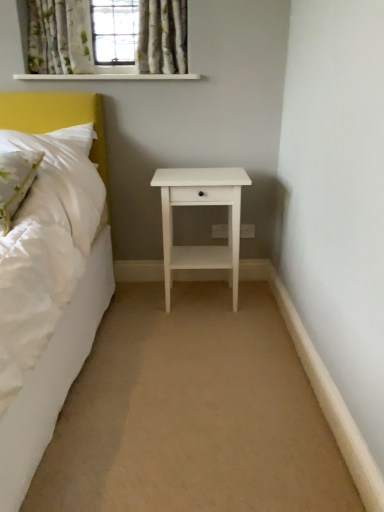
Measure the distance between floral fabric curtain at upper center, which is counted as the second curtain, starting from the left, and camera.

floral fabric curtain at upper center, which is counted as the second curtain, starting from the left, is 2.05 meters from camera.

Image resolution: width=384 pixels, height=512 pixels. What do you see at coordinates (107, 40) in the screenshot?
I see `patterned fabric curtain at upper center` at bounding box center [107, 40].

You are a GUI agent. You are given a task and a screenshot of the screen. Output one action in this format:
    pyautogui.click(x=<x>, y=<y>)
    Task: Click on the white wooden shelf at upper center
    The height and width of the screenshot is (512, 384).
    Given the screenshot: What is the action you would take?
    pyautogui.click(x=109, y=77)

How much space does green floral fabric curtain at upper left, the second curtain positioned from the right, occupy vertically?

green floral fabric curtain at upper left, the second curtain positioned from the right, is 14.99 inches tall.

Image resolution: width=384 pixels, height=512 pixels. I want to click on white matte nightstand at center, so click(201, 205).

Locate an element on the screen. floral fabric curtain at upper center, which is counted as the second curtain, starting from the left is located at coordinates (162, 37).

Does green floral fabric curtain at upper left, the second curtain positioned from the right, lie behind white matte nightstand at center?

That is True.

Is green floral fabric curtain at upper left, the second curtain positioned from the right, at the left side of white matte nightstand at center?

Indeed, green floral fabric curtain at upper left, the second curtain positioned from the right, is positioned on the left side of white matte nightstand at center.

Is point (84, 55) less distant than point (163, 193)?

That is False.

Looking at this image, from a real-world perspective, between green floral fabric curtain at upper left, which is counted as the 1th curtain, starting from the left, and white matte nightstand at center, who is vertically lower?

white matte nightstand at center.

Looking at the image, does patterned fabric curtain at upper center seem bigger or smaller compared to green floral fabric pillow at left?

Clearly, patterned fabric curtain at upper center is larger in size than green floral fabric pillow at left.

Is patterned fabric curtain at upper center looking in the opposite direction of green floral fabric pillow at left?

That's not correct — patterned fabric curtain at upper center is not looking away from green floral fabric pillow at left.

In the image, is patterned fabric curtain at upper center on the left side or the right side of green floral fabric pillow at left?

From the image, it's evident that patterned fabric curtain at upper center is to the right of green floral fabric pillow at left.

Between patterned fabric curtain at upper center and green floral fabric pillow at left, which one is positioned in front?

green floral fabric pillow at left is closer to the camera.

From the image's perspective, who appears lower, white matte nightstand at center or patterned fabric curtain at upper center?

white matte nightstand at center is shown below in the image.

Is white matte nightstand at center located outside patterned fabric curtain at upper center?

Yes, white matte nightstand at center is located beyond the bounds of patterned fabric curtain at upper center.

How many degrees apart are the facing directions of white matte nightstand at center and patterned fabric curtain at upper center?

The angle between the facing direction of white matte nightstand at center and the facing direction of patterned fabric curtain at upper center is 0.758 degrees.

From a real-world perspective, relative to green floral fabric pillow at left, is beige carpet at center vertically above or below?

beige carpet at center is below green floral fabric pillow at left.

Does point (211, 433) appear closer or farther from the camera than point (15, 193)?

Point (211, 433).

Considering the relative sizes of beige carpet at center and green floral fabric pillow at left in the image provided, is beige carpet at center taller than green floral fabric pillow at left?

Incorrect, the height of beige carpet at center is not larger of that of green floral fabric pillow at left.

Based on the photo, can we say beige carpet at center lies outside green floral fabric pillow at left?

Result: beige carpet at center is positioned outside green floral fabric pillow at left.

Which of these two, beige carpet at center or white matte nightstand at center, stands shorter?

With less height is beige carpet at center.

Is beige carpet at center facing away from white matte nightstand at center?

No.

From the image's perspective, is beige carpet at center above or below white matte nightstand at center?

Based on their image positions, beige carpet at center is located beneath white matte nightstand at center.

Which of these two, floral fabric curtain at upper center, the 1th curtain positioned from the right, or green floral fabric pillow at left, stands shorter?

green floral fabric pillow at left is shorter.

Which is further, (185, 30) or (26, 166)?

The point (185, 30) is farther from the camera.

Where is `pillow lying below the floral fabric curtain at upper center, which is counted as the second curtain, starting from the left (from the image's perspective)`? The image size is (384, 512). pillow lying below the floral fabric curtain at upper center, which is counted as the second curtain, starting from the left (from the image's perspective) is located at coordinates (15, 182).

Which of these two, floral fabric curtain at upper center, the 1th curtain positioned from the right, or green floral fabric pillow at left, is bigger?

green floral fabric pillow at left.

Is the depth of green floral fabric pillow at left less than that of white matte nightstand at center?

Yes.

Which is more to the right, green floral fabric pillow at left or white matte nightstand at center?

From the viewer's perspective, white matte nightstand at center appears more on the right side.

Is green floral fabric pillow at left oriented towards white matte nightstand at center?

No, green floral fabric pillow at left is not aimed at white matte nightstand at center.

Is point (8, 209) behind point (218, 169)?

No, it is in front of (218, 169).

The height and width of the screenshot is (512, 384). Find the location of `nightstand in front of the green floral fabric curtain at upper left, which is counted as the 1th curtain, starting from the left`. nightstand in front of the green floral fabric curtain at upper left, which is counted as the 1th curtain, starting from the left is located at coordinates (201, 205).

At what (x,y) coordinates should I click in order to perform the action: click on pillow below the patterned fabric curtain at upper center (from the image's perspective). Please return your answer as a coordinate pair (x, y). The height and width of the screenshot is (512, 384). Looking at the image, I should click on (15, 182).

When comparing their distances from green floral fabric pillow at left, does patterned fabric curtain at upper center or floral fabric curtain at upper center, the 1th curtain positioned from the right, seem closer?

Among the two, patterned fabric curtain at upper center is located nearer to green floral fabric pillow at left.

Which object lies nearer to the anchor point white wooden shelf at upper center, green floral fabric curtain at upper left, the second curtain positioned from the right, or white matte nightstand at center?

green floral fabric curtain at upper left, the second curtain positioned from the right.

Looking at this image, from the image, which object appears to be nearer to green floral fabric curtain at upper left, the second curtain positioned from the right, beige carpet at center or white matte nightstand at center?

Based on the image, white matte nightstand at center appears to be nearer to green floral fabric curtain at upper left, the second curtain positioned from the right.

Based on their spatial positions, is white matte nightstand at center or patterned fabric curtain at upper center further from green floral fabric pillow at left?

patterned fabric curtain at upper center is positioned further to the anchor green floral fabric pillow at left.

Looking at the image, which one is located further to white matte nightstand at center, floral fabric curtain at upper center, the 1th curtain positioned from the right, or white wooden shelf at upper center?

Among the two, white wooden shelf at upper center is located further to white matte nightstand at center.

From the image, which object appears to be nearer to green floral fabric curtain at upper left, the second curtain positioned from the right, white matte nightstand at center or white wooden shelf at upper center?

white wooden shelf at upper center lies closer to green floral fabric curtain at upper left, the second curtain positioned from the right, than the other object.

From the picture: Looking at the image, which one is located further to green floral fabric curtain at upper left, the second curtain positioned from the right, patterned fabric curtain at upper center or white matte nightstand at center?

The object further to green floral fabric curtain at upper left, the second curtain positioned from the right, is white matte nightstand at center.

Considering their positions, is green floral fabric pillow at left positioned further to green floral fabric curtain at upper left, which is counted as the 1th curtain, starting from the left, than patterned fabric curtain at upper center?

green floral fabric pillow at left is further to green floral fabric curtain at upper left, which is counted as the 1th curtain, starting from the left.

In order to click on nightstand between patterned fabric curtain at upper center and beige carpet at center vertically in this screenshot , I will do `click(201, 205)`.

I want to click on curtain between green floral fabric curtain at upper left, the second curtain positioned from the right, and green floral fabric pillow at left in the up-down direction, so click(x=162, y=37).

Find the location of a particular element. This screenshot has width=384, height=512. pillow that lies between floral fabric curtain at upper center, the 1th curtain positioned from the right, and beige carpet at center from top to bottom is located at coordinates (15, 182).

This screenshot has height=512, width=384. Find the location of `window sill that lies between patterned fabric curtain at upper center and green floral fabric pillow at left from top to bottom`. window sill that lies between patterned fabric curtain at upper center and green floral fabric pillow at left from top to bottom is located at coordinates (109, 77).